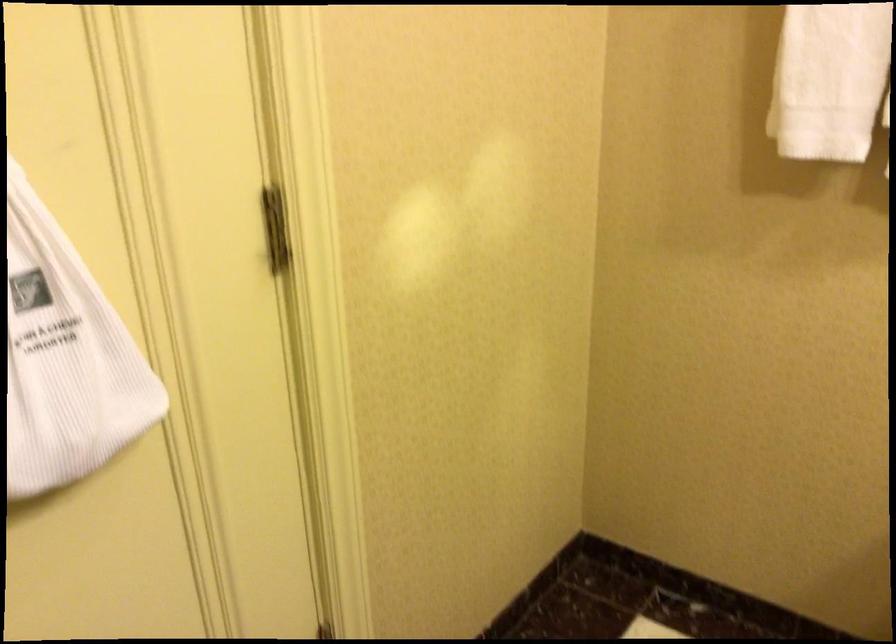
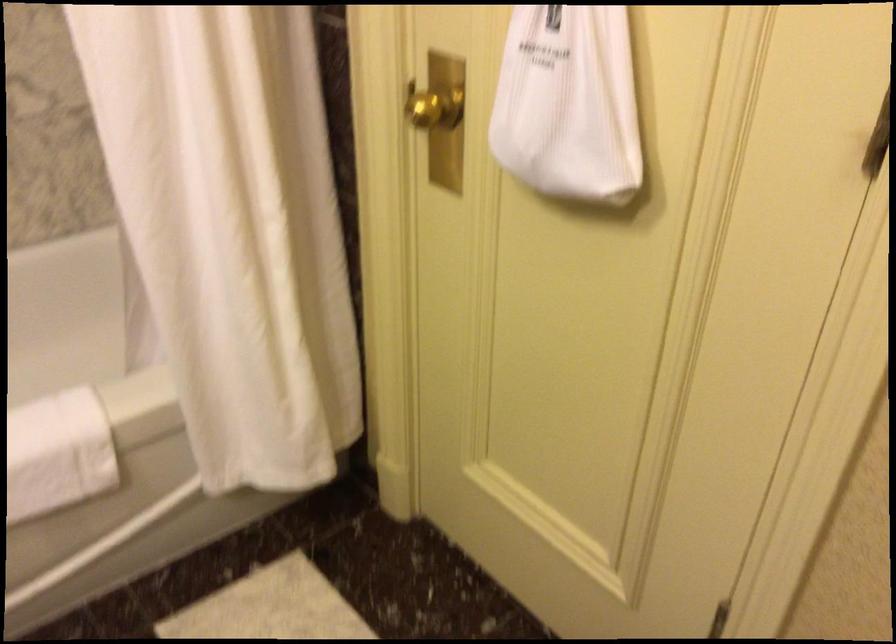
The first image is from the beginning of the video and the second image is from the end. How did the camera likely rotate when shooting the video?

The camera rotated toward left-down.